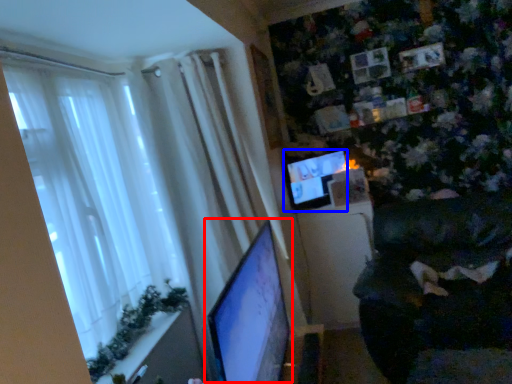
Question: Which object is closer to the camera taking this photo, computer monitor (highlighted by a red box) or computer monitor (highlighted by a blue box)?

Choices:
 (A) computer monitor
 (B) computer monitor

Answer: (A)